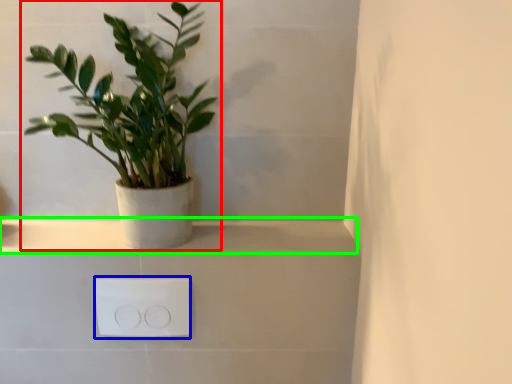
Question: Estimate the real-world distances between objects in this image. Which object is farther from houseplant (highlighted by a red box), electric outlet (highlighted by a blue box) or window sill (highlighted by a green box)?

Choices:
 (A) electric outlet
 (B) window sill

Answer: (A)